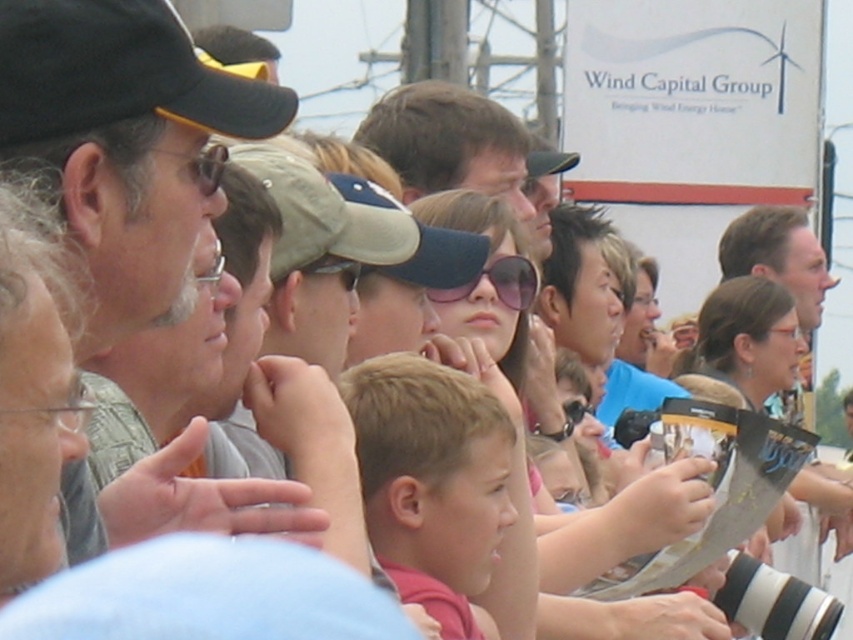
Question: Is light brown cap at center positioned behind pink reflective sunglasses at center?

Choices:
 (A) yes
 (B) no

Answer: (A)

Question: Can you confirm if blonde hair at center is positioned below pink reflective sunglasses at center?

Choices:
 (A) no
 (B) yes

Answer: (B)

Question: Which point is farther to the camera?

Choices:
 (A) light brown cap at center
 (B) pink reflective sunglasses at center
 (C) matte black cap at left

Answer: (A)

Question: Which point is farther to the camera?

Choices:
 (A) pink reflective sunglasses at center
 (B) blonde hair at center

Answer: (A)

Question: Among these objects, which one is nearest to the camera?

Choices:
 (A) matte black cap at left
 (B) pink reflective sunglasses at center

Answer: (A)

Question: Is blonde hair at center to the left of pink reflective sunglasses at center from the viewer's perspective?

Choices:
 (A) no
 (B) yes

Answer: (B)